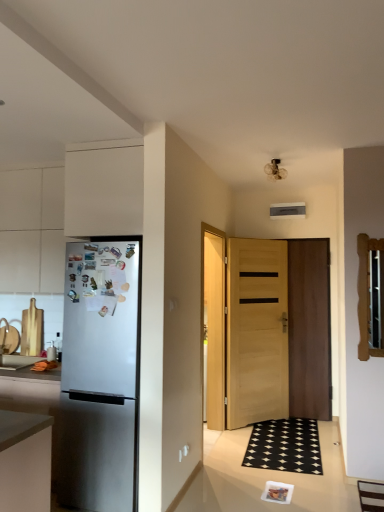
This screenshot has width=384, height=512. In order to click on white matte cabinet at upper left, the 1th cabinetry from the right in this screenshot , I will do `click(104, 189)`.

Which of these two, wooden door at center, the 2th door when ordered from left to right, or white matte cabinet at left, acting as the second cabinetry starting from the front, stands shorter?

With less height is white matte cabinet at left, acting as the second cabinetry starting from the front.

Considering the relative sizes of wooden door at center, positioned as the first door in right-to-left order, and white matte cabinet at left, placed as the first cabinetry when sorted from back to front, in the image provided, is wooden door at center, positioned as the first door in right-to-left order, thinner than white matte cabinet at left, placed as the first cabinetry when sorted from back to front,?

Yes, wooden door at center, positioned as the first door in right-to-left order, is thinner than white matte cabinet at left, placed as the first cabinetry when sorted from back to front.

Which is in front, wooden door at center, positioned as the first door in right-to-left order, or white matte cabinet at left, arranged as the first cabinetry when viewed from the left?

white matte cabinet at left, arranged as the first cabinetry when viewed from the left, is closer to the camera.

Is white matte cabinet at left, acting as the second cabinetry starting from the front, completely or partially inside wooden door at center, the 2th door when ordered from left to right?

No, wooden door at center, the 2th door when ordered from left to right, does not contain white matte cabinet at left, acting as the second cabinetry starting from the front.

Find the location of a particular element. Image resolution: width=384 pixels, height=512 pixels. countertop on the left of the light brown wooden door at center, positioned as the 2th door in right-to-left order is located at coordinates (29, 369).

Is light brown wooden door at center, positioned as the 2th door in right-to-left order, in front of or behind matte gray countertop at left in the image?

Visually, light brown wooden door at center, positioned as the 2th door in right-to-left order, is located behind matte gray countertop at left.

Does light brown wooden door at center, which is the first door in left-to-right order, have a greater width compared to matte gray countertop at left?

Incorrect, the width of light brown wooden door at center, which is the first door in left-to-right order, does not surpass that of matte gray countertop at left.

Considering the relative sizes of light brown wooden door at center, which is the first door in left-to-right order, and matte gray countertop at left in the image provided, is light brown wooden door at center, which is the first door in left-to-right order, smaller than matte gray countertop at left?

Incorrect, light brown wooden door at center, which is the first door in left-to-right order, is not smaller in size than matte gray countertop at left.

From a real-world perspective, which is physically below, white matte cabinet at upper left, the 1th cabinetry from the front, or white matte cabinet at left, arranged as the first cabinetry when viewed from the left?

From a 3D spatial view, white matte cabinet at left, arranged as the first cabinetry when viewed from the left, is below.

Is white matte cabinet at upper left, acting as the 2th cabinetry starting from the back, far away from white matte cabinet at left, positioned as the 2th cabinetry in right-to-left order?

Actually, white matte cabinet at upper left, acting as the 2th cabinetry starting from the back, and white matte cabinet at left, positioned as the 2th cabinetry in right-to-left order, are a little close together.

Looking at the image, does white matte cabinet at upper left, the 1th cabinetry from the front, seem bigger or smaller compared to white matte cabinet at left, arranged as the first cabinetry when viewed from the left?

white matte cabinet at upper left, the 1th cabinetry from the front, is smaller than white matte cabinet at left, arranged as the first cabinetry when viewed from the left.

Considering the relative positions of white matte cabinet at upper left, acting as the 2th cabinetry starting from the back, and white matte cabinet at left, positioned as the 2th cabinetry in right-to-left order, in the image provided, is white matte cabinet at upper left, acting as the 2th cabinetry starting from the back, to the left of white matte cabinet at left, positioned as the 2th cabinetry in right-to-left order, from the viewer's perspective?

Incorrect, white matte cabinet at upper left, acting as the 2th cabinetry starting from the back, is not on the left side of white matte cabinet at left, positioned as the 2th cabinetry in right-to-left order.

Is point (4, 358) less distant than point (97, 255)?

No, (4, 358) is behind (97, 255).

Is matte gray countertop at left shorter than satin silver refrigerator at left?

Yes.

Is matte gray countertop at left positioned far away from satin silver refrigerator at left?

matte gray countertop at left is near satin silver refrigerator at left, not far away.

From a real-world perspective, between matte gray countertop at left and satin silver refrigerator at left, who is vertically lower?

matte gray countertop at left, from a real-world perspective.

Considering the relative positions of white matte cabinet at left, acting as the second cabinetry starting from the front, and matte gray countertop at left in the image provided, is white matte cabinet at left, acting as the second cabinetry starting from the front, to the right of matte gray countertop at left from the viewer's perspective?

Yes, white matte cabinet at left, acting as the second cabinetry starting from the front, is to the right of matte gray countertop at left.

Are white matte cabinet at left, placed as the first cabinetry when sorted from back to front, and matte gray countertop at left far apart?

white matte cabinet at left, placed as the first cabinetry when sorted from back to front, is actually quite close to matte gray countertop at left.

Is white matte cabinet at left, positioned as the 2th cabinetry in right-to-left order, positioned in front of matte gray countertop at left?

No, it is not.

Consider the image. Does white matte cabinet at left, positioned as the 2th cabinetry in right-to-left order, turn towards matte gray countertop at left?

No, white matte cabinet at left, positioned as the 2th cabinetry in right-to-left order, is not turned towards matte gray countertop at left.

From the image's perspective, which one is positioned higher, satin silver refrigerator at left or white matte cabinet at upper left, placed as the 2th cabinetry when sorted from left to right?

white matte cabinet at upper left, placed as the 2th cabinetry when sorted from left to right, appears higher in the image.

Where is `refrigerator in front of the white matte cabinet at upper left, acting as the 2th cabinetry starting from the back`? This screenshot has height=512, width=384. refrigerator in front of the white matte cabinet at upper left, acting as the 2th cabinetry starting from the back is located at coordinates (101, 374).

Is white matte cabinet at upper left, the 1th cabinetry from the right, surrounded by satin silver refrigerator at left?

No, white matte cabinet at upper left, the 1th cabinetry from the right, is not surrounded by satin silver refrigerator at left.

Is satin silver refrigerator at left next to white matte cabinet at upper left, acting as the 2th cabinetry starting from the back?

No, satin silver refrigerator at left is not in contact with white matte cabinet at upper left, acting as the 2th cabinetry starting from the back.

In the scene shown: From the image's perspective, is matte gray countertop at left on top of light brown wooden door at center, positioned as the 2th door in right-to-left order?

Incorrect, from the image's perspective, matte gray countertop at left is lower than light brown wooden door at center, positioned as the 2th door in right-to-left order.

How far apart are matte gray countertop at left and light brown wooden door at center, positioned as the 2th door in right-to-left order?

7.46 feet.

From a real-world perspective, which object stands above the other?

In real-world perspective, light brown wooden door at center, which is the first door in left-to-right order, is above.

Is matte gray countertop at left inside or outside of light brown wooden door at center, positioned as the 2th door in right-to-left order?

matte gray countertop at left is spatially situated outside light brown wooden door at center, positioned as the 2th door in right-to-left order.

There is a white matte cabinet at left, acting as the second cabinetry starting from the front. At what (x,y) coordinates should I click in order to perform the action: click on the 1st door below it (from a real-world perspective). Please return your answer as a coordinate pair (x, y). Looking at the image, I should click on (309, 329).

What are the coordinates of `countertop in front of the light brown wooden door at center, which is the first door in left-to-right order` in the screenshot? It's located at (29, 369).

When comparing their distances from wooden door at center, the 2th door when ordered from left to right, does satin silver refrigerator at left or white matte cabinet at left, positioned as the 2th cabinetry in right-to-left order, seem closer?

satin silver refrigerator at left.

Looking at the image, which one is located closer to wooden door at center, positioned as the first door in right-to-left order, white matte cabinet at upper left, the 1th cabinetry from the right, or satin silver refrigerator at left?

satin silver refrigerator at left lies closer to wooden door at center, positioned as the first door in right-to-left order, than the other object.

Estimate the real-world distances between objects in this image. Which object is further from satin silver refrigerator at left, matte gray countertop at left or white matte cabinet at upper left, acting as the 2th cabinetry starting from the back?

The object further to satin silver refrigerator at left is matte gray countertop at left.

Looking at the image, which one is located closer to satin silver refrigerator at left, white matte cabinet at upper left, the 1th cabinetry from the front, or wooden door at center, the 2th door when ordered from left to right?

white matte cabinet at upper left, the 1th cabinetry from the front, is positioned closer to the anchor satin silver refrigerator at left.

Considering their positions, is white matte cabinet at left, positioned as the 2th cabinetry in right-to-left order, positioned further to satin silver refrigerator at left than wooden door at center, the 2th door when ordered from left to right?

The object further to satin silver refrigerator at left is wooden door at center, the 2th door when ordered from left to right.

Which object lies further to the anchor point white matte cabinet at left, placed as the first cabinetry when sorted from back to front, matte gray countertop at left or white matte cabinet at upper left, the 1th cabinetry from the front?

Among the two, matte gray countertop at left is located further to white matte cabinet at left, placed as the first cabinetry when sorted from back to front.

Which object lies further to the anchor point light brown wooden door at center, which is the first door in left-to-right order, matte gray countertop at left or wooden door at center, positioned as the first door in right-to-left order?

matte gray countertop at left.

From the image, which object appears to be farther from light brown wooden door at center, positioned as the 2th door in right-to-left order, satin silver refrigerator at left or wooden door at center, positioned as the first door in right-to-left order?

Based on the image, satin silver refrigerator at left appears to be further to light brown wooden door at center, positioned as the 2th door in right-to-left order.

Where is `door between white matte cabinet at upper left, placed as the 2th cabinetry when sorted from left to right, and wooden door at center, the 2th door when ordered from left to right, along the z-axis`? door between white matte cabinet at upper left, placed as the 2th cabinetry when sorted from left to right, and wooden door at center, the 2th door when ordered from left to right, along the z-axis is located at coordinates (257, 331).

Find the location of a particular element. The width and height of the screenshot is (384, 512). door between matte gray countertop at left and wooden door at center, positioned as the first door in right-to-left order, in the horizontal direction is located at coordinates [257, 331].

Where is `refrigerator between white matte cabinet at left, arranged as the first cabinetry when viewed from the left, and matte gray countertop at left, in the vertical direction`? The height and width of the screenshot is (512, 384). refrigerator between white matte cabinet at left, arranged as the first cabinetry when viewed from the left, and matte gray countertop at left, in the vertical direction is located at coordinates (101, 374).

At what (x,y) coordinates should I click in order to perform the action: click on refrigerator between white matte cabinet at left, arranged as the first cabinetry when viewed from the left, and light brown wooden door at center, positioned as the 2th door in right-to-left order, in the horizontal direction. Please return your answer as a coordinate pair (x, y). This screenshot has width=384, height=512. Looking at the image, I should click on (101, 374).